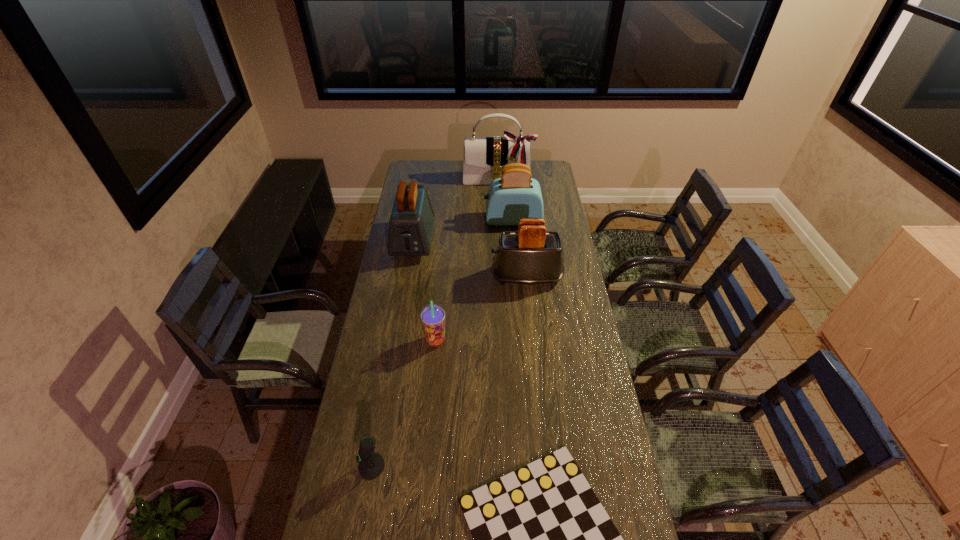
Locate an element on the screen. This screenshot has height=540, width=960. the tallest object is located at coordinates (484, 157).

The image size is (960, 540). What are the coordinates of `satchel` in the screenshot? It's located at (484, 157).

What are the coordinates of `the leftmost toaster` in the screenshot? It's located at (411, 222).

Locate an element on the screen. the fifth farthest object is located at coordinates (432, 316).

At what (x,y) coordinates should I click in order to perform the action: click on smoothie. Please return your answer as a coordinate pair (x, y). Image resolution: width=960 pixels, height=540 pixels. Looking at the image, I should click on (432, 316).

Locate an element on the screen. This screenshot has height=540, width=960. the second shortest object is located at coordinates (371, 465).

Locate an element on the screen. The width and height of the screenshot is (960, 540). vacant region located 0.330m on the front-facing side of the farthest object is located at coordinates (500, 221).

At what (x,y) coordinates should I click in order to perform the action: click on free space located 0.180m on the front-facing side of the leftmost toaster. Please return your answer as a coordinate pair (x, y). The width and height of the screenshot is (960, 540). Looking at the image, I should click on (405, 291).

The width and height of the screenshot is (960, 540). In order to click on free location located 0.330m on the right of the fifth tallest object in this screenshot , I will do `click(530, 341)`.

The width and height of the screenshot is (960, 540). In order to click on free space located 0.080m on the front of the microphone in this screenshot , I will do `click(365, 507)`.